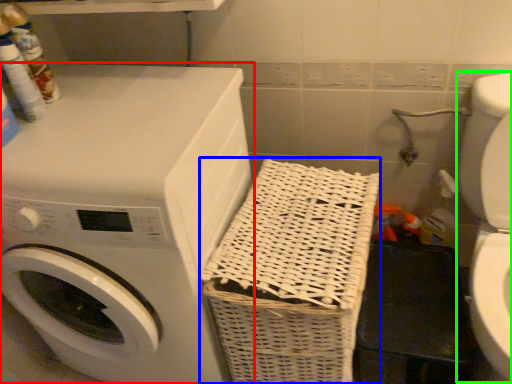
Question: Which object is the closest to the washing machine (highlighted by a red box)? Choose among these: basket (highlighted by a blue box) or washer (highlighted by a green box).

Choices:
 (A) basket
 (B) washer

Answer: (A)